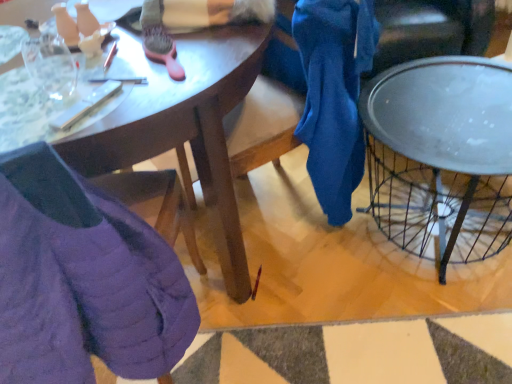
Find the location of `vacant space positioned to the left of metallic silver tray at right`. vacant space positioned to the left of metallic silver tray at right is located at coordinates (306, 300).